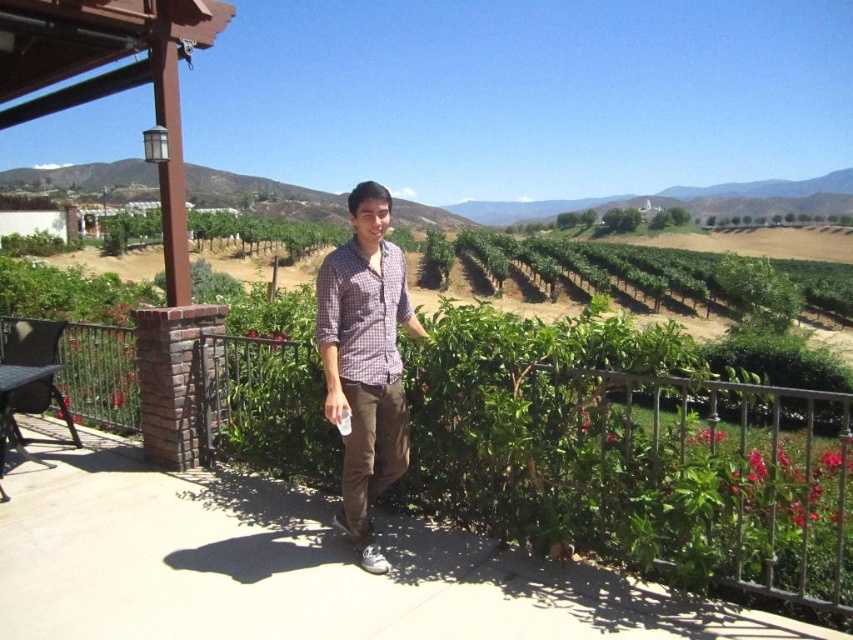
What are the coordinates of the brown concrete porch at center?

The brown concrete porch at center is located at point [637,468].

You are a drone operator trying to capture a photo of the vineyard from above. You have two points marked in the scene, point A at coordinates point (850, 490) and point B at coordinates point (357, 355). Which point is closer to the camera lens to ensure the photo captures the foreground details clearly?

Point A at coordinates point (850, 490) is closer to the camera lens because it is further to the viewer than point B at coordinates point (357, 355), making it better for capturing foreground details.

You are a delivery robot with a width of 1.5 meters. You need to move from the brown concrete porch at center to the plaid cotton shirt at center. Can you fit through the space between them?

The distance between the brown concrete porch at center and the plaid cotton shirt at center is 1.66 meters. Since the robot is 1.5 meters wide, it can fit through the space as the distance is greater than the robot width.